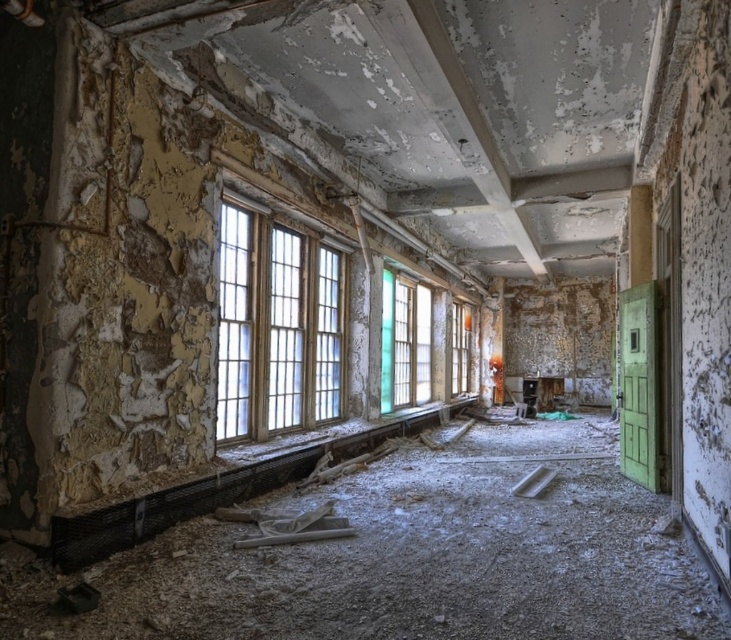
What do you see at coordinates (276, 324) in the screenshot? Image resolution: width=731 pixels, height=640 pixels. I see `clear glass window at center` at bounding box center [276, 324].

The width and height of the screenshot is (731, 640). Identify the location of clear glass window at center. (276, 324).

Where is `clear glass window at center`? This screenshot has height=640, width=731. clear glass window at center is located at coordinates (276, 324).

Does green glass window at center lie in front of translucent glass window at center?

Yes, it is in front of translucent glass window at center.

Does green glass window at center have a greater width compared to translucent glass window at center?

Yes.

Find the location of a particular element. green glass window at center is located at coordinates point(405,342).

Between clear glass window at center and green glass window at center, which one has more height?

clear glass window at center

Who is shorter, clear glass window at center or green glass window at center?

Standing shorter between the two is green glass window at center.

Is point (341, 412) more distant than point (417, 381)?

No.

This screenshot has width=731, height=640. In order to click on clear glass window at center in this screenshot , I will do `click(276, 324)`.